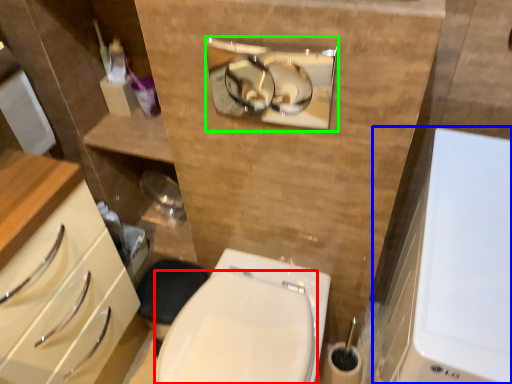
Question: Which object is the farthest from bidet (highlighted by a red box)? Choose among these: medicine cabinet (highlighted by a blue box) or medicine cabinet (highlighted by a green box).

Choices:
 (A) medicine cabinet
 (B) medicine cabinet

Answer: (B)